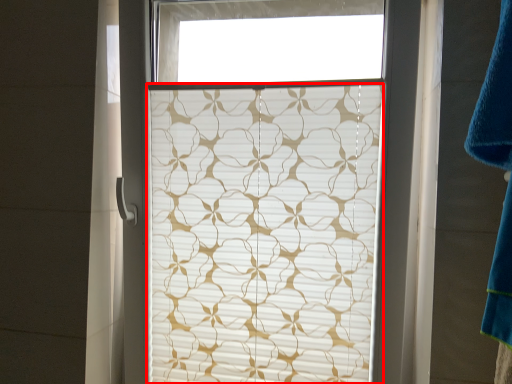
Question: Observing the image, what is the correct spatial positioning of window blind (annotated by the red box) in reference to bath towel?

Choices:
 (A) left
 (B) right

Answer: (A)